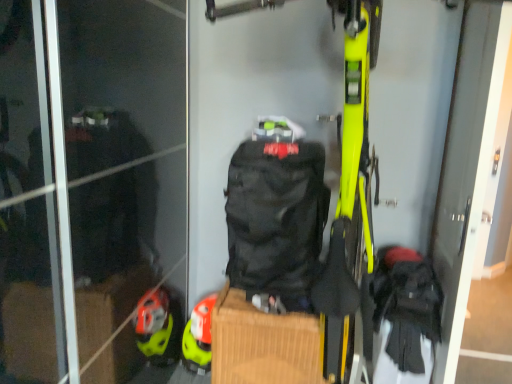
Question: Does point (247, 297) appear closer or farther from the camera than point (487, 29)?

Choices:
 (A) closer
 (B) farther

Answer: (B)

Question: Based on their positions, is black fabric backpack at center located to the left or right of black fabric screen door at right?

Choices:
 (A) left
 (B) right

Answer: (A)

Question: Which object is the closest to the black fabric screen door at right?

Choices:
 (A) matte yellow helmet at lower left
 (B) black fabric backpack at center

Answer: (B)

Question: Estimate the real-world distances between objects in this image. Which object is closer to the black fabric screen door at right?

Choices:
 (A) matte yellow helmet at lower left
 (B) black fabric backpack at center

Answer: (B)